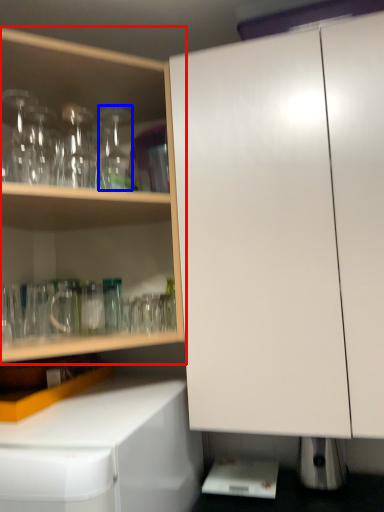
Question: Which of the following is the closest to the observer, cabinetry (highlighted by a red box) or bottle (highlighted by a blue box)?

Choices:
 (A) cabinetry
 (B) bottle

Answer: (A)